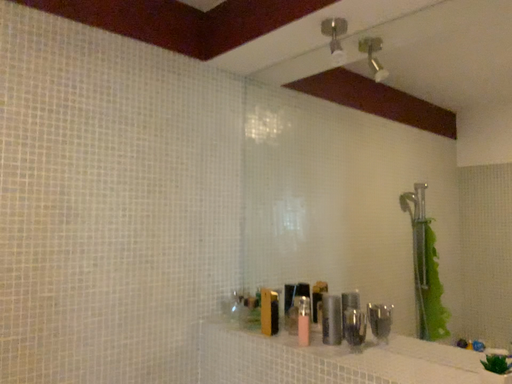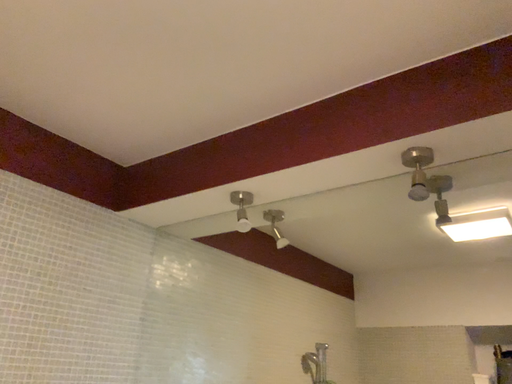
Question: Which way did the camera rotate in the video?

Choices:
 (A) rotated downward
 (B) rotated upward

Answer: (B)